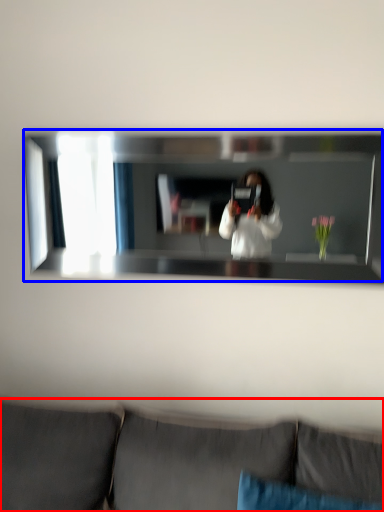
Question: Which object appears closest to the camera in this image, studio couch (highlighted by a red box) or mirror (highlighted by a blue box)?

Choices:
 (A) studio couch
 (B) mirror

Answer: (A)